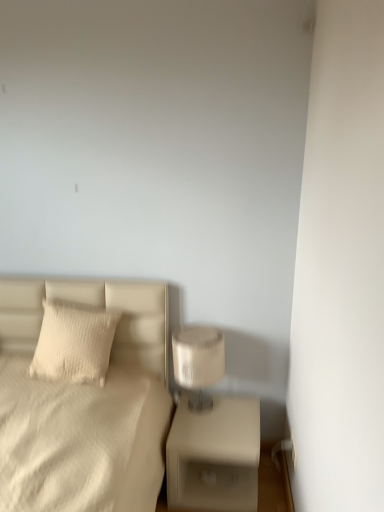
I want to click on empty space that is ontop of beige matte nightstand at lower right (from a real-world perspective), so click(223, 417).